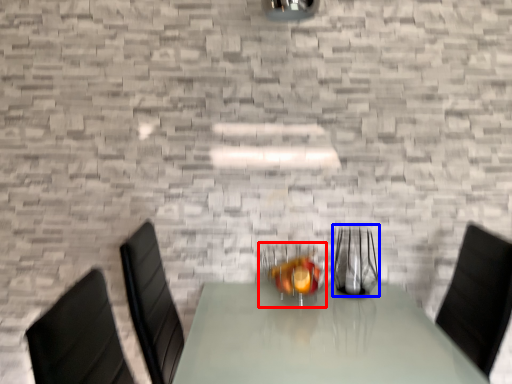
Question: Which of the following is the farthest to the observer, tableware (highlighted by a red box) or tableware (highlighted by a blue box)?

Choices:
 (A) tableware
 (B) tableware

Answer: (B)